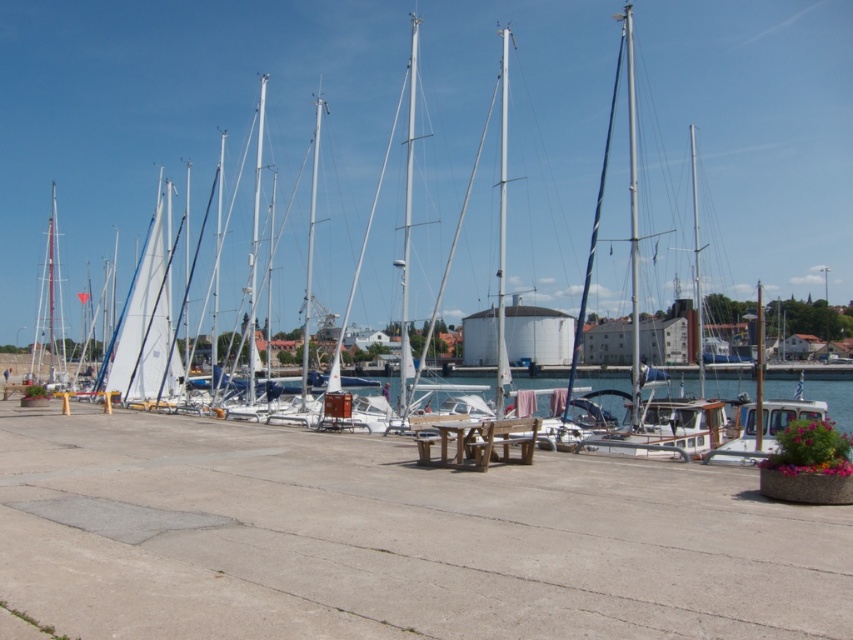
Question: Which object appears closest to the camera in this image?

Choices:
 (A) wooden picnic table at center
 (B) white wooden boat at center

Answer: (A)

Question: Can you confirm if white matte sailboat at center is positioned above wooden picnic table at center?

Choices:
 (A) yes
 (B) no

Answer: (A)

Question: Based on their relative distances, which object is nearer to the white metallic mast at center?

Choices:
 (A) white matte mast at center
 (B) white glossy mast at center
 (C) white wooden boat at center

Answer: (B)

Question: Does wooden picnic table at center appear on the right side of white metallic mast at center?

Choices:
 (A) no
 (B) yes

Answer: (B)

Question: Which of the following is the farthest from the observer?

Choices:
 (A) white wooden boat at center
 (B) white matte sailboat at center
 (C) wooden picnic table at center

Answer: (B)

Question: Can you confirm if white glossy boat at center is wider than white metallic mast at center?

Choices:
 (A) no
 (B) yes

Answer: (A)